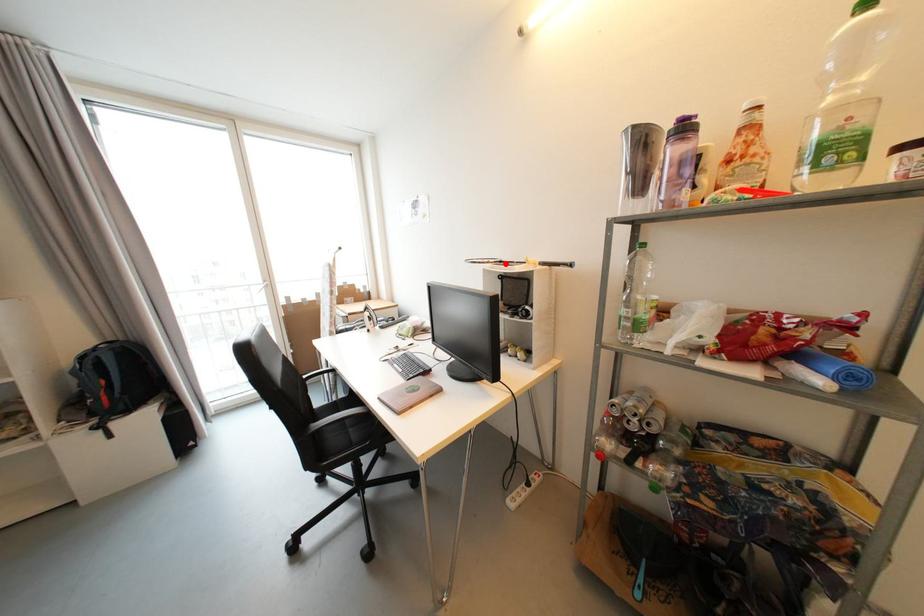
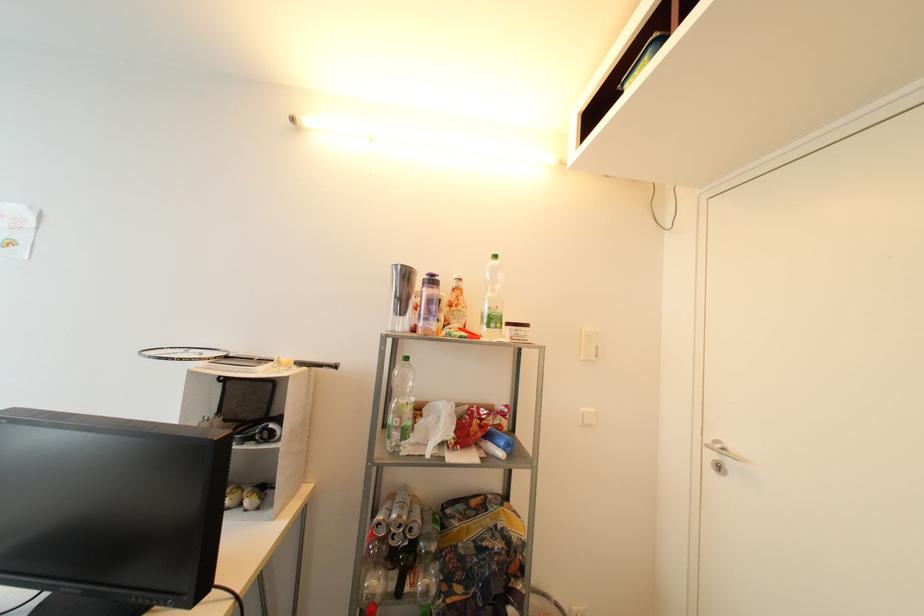
Locate, in the second image, the point that corresponds to the highlighted location in the first image.

(232, 359)